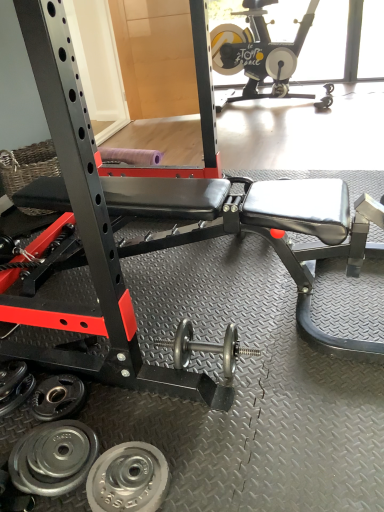
I want to click on free area behind silver metallic weight plate at lower left, which ranks as the first wheel in front-to-back order, so click(140, 420).